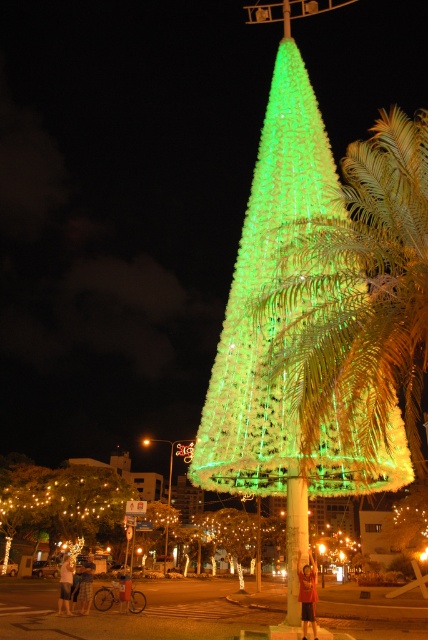
You are a photographer standing at the lower left corner of the image. You want to take a photo of the green plastic pole at center and the light brown shorts at lower left. Which object will appear higher in your photo?

The green plastic pole at center appears higher in the photo because it is positioned above the light brown shorts at lower left.

You are standing in front of the large Christmas tree and notice a specific point in the image. Can you identify what is located at the coordinates point [61,500]?

At point [61,500] lies illuminated string lights at lower left.

You are standing at the center of the image and want to locate the green metallic palm tree at center. What are the coordinates where you should look?

The green metallic palm tree at center is located at coordinates point (357, 300).